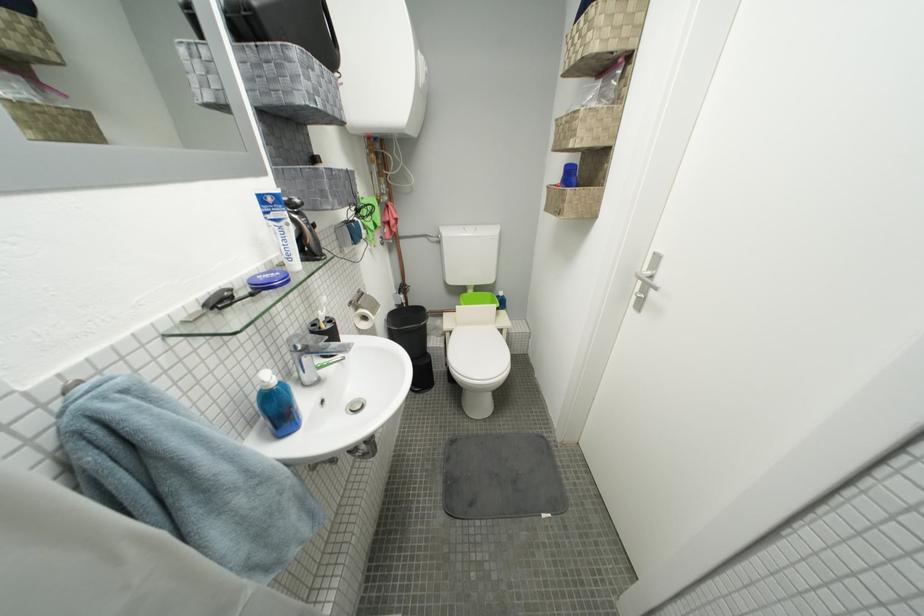
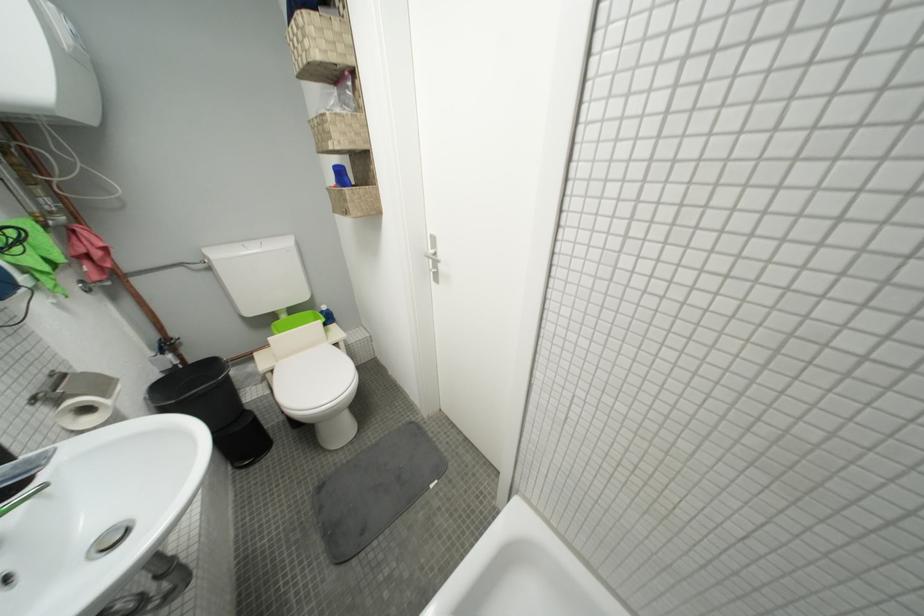
The point at (383,315) is marked in the first image. Where is the corresponding point in the second image?

(113, 397)